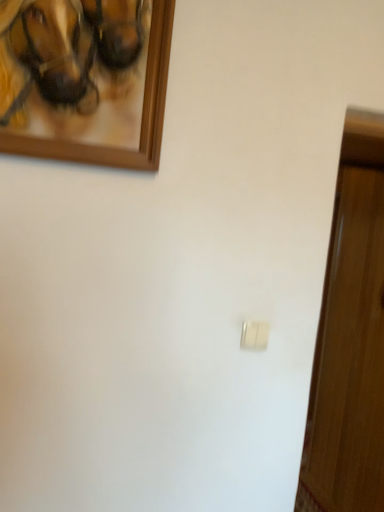
Question: Relative to white plastic light switch at center, is wooden picture frame at upper left in front or behind?

Choices:
 (A) front
 (B) behind

Answer: (A)

Question: Is wooden picture frame at upper left inside the boundaries of white plastic light switch at center, or outside?

Choices:
 (A) inside
 (B) outside

Answer: (B)

Question: Would you say wooden picture frame at upper left is to the left or to the right of white plastic light switch at center in the picture?

Choices:
 (A) right
 (B) left

Answer: (B)

Question: Would you say white plastic light switch at center is to the left or to the right of wooden picture frame at upper left in the picture?

Choices:
 (A) left
 (B) right

Answer: (B)

Question: From the image's perspective, relative to wooden picture frame at upper left, is white plastic light switch at center above or below?

Choices:
 (A) above
 (B) below

Answer: (B)

Question: Does point (264, 346) appear closer or farther from the camera than point (36, 117)?

Choices:
 (A) farther
 (B) closer

Answer: (A)

Question: Looking at the image, does white plastic light switch at center seem bigger or smaller compared to wooden picture frame at upper left?

Choices:
 (A) big
 (B) small

Answer: (B)